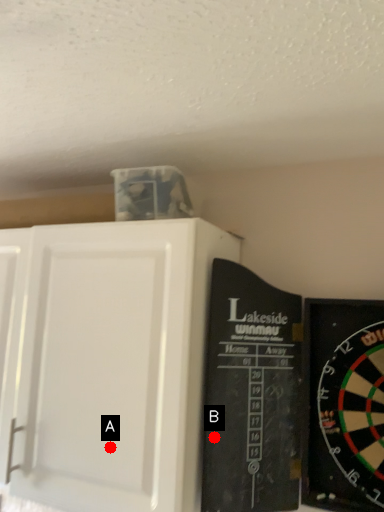
Question: Two points are circled on the image, labeled by A and B beside each circle. Which of the following is the farthest from the observer?

Choices:
 (A) A is further
 (B) B is further

Answer: (A)